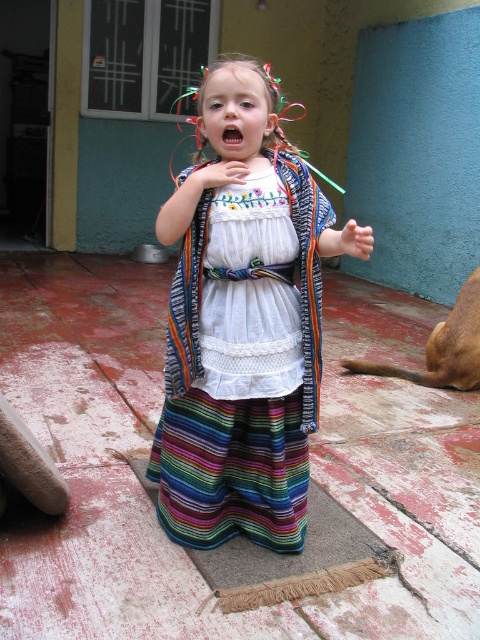
Question: Does striped cotton dress at center appear on the left side of white embroidered dress at center?

Choices:
 (A) no
 (B) yes

Answer: (B)

Question: Does striped cotton dress at center appear on the left side of white embroidered dress at center?

Choices:
 (A) no
 (B) yes

Answer: (B)

Question: Which object appears closest to the camera in this image?

Choices:
 (A) white embroidered dress at center
 (B) striped cotton dress at center
 (C) brown fur dog at lower right

Answer: (B)

Question: Which point is farther to the camera?

Choices:
 (A) brown fur dog at lower right
 (B) striped cotton dress at center

Answer: (A)

Question: Among these points, which one is farthest from the camera?

Choices:
 (A) (204, 301)
 (B) (231, 214)
 (C) (468, 285)

Answer: (C)

Question: Does striped cotton dress at center have a greater width compared to white embroidered dress at center?

Choices:
 (A) yes
 (B) no

Answer: (A)